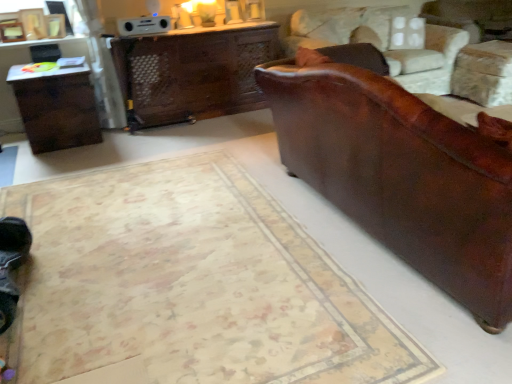
Image resolution: width=512 pixels, height=384 pixels. I want to click on vacant space in between leather couch at right and dark brown wood table at left, so click(x=196, y=185).